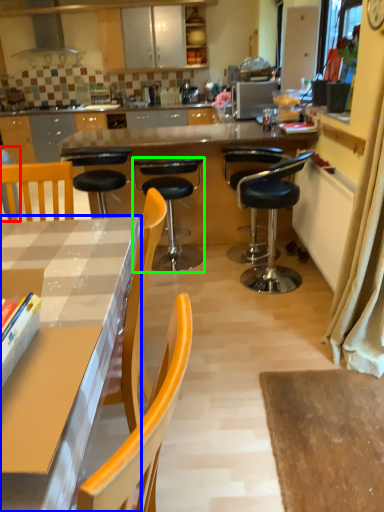
Question: Which object is positioned farthest from armchair (highlighted by a red box)? Select from countertop (highlighted by a blue box) and chair (highlighted by a green box).

Choices:
 (A) countertop
 (B) chair

Answer: (A)